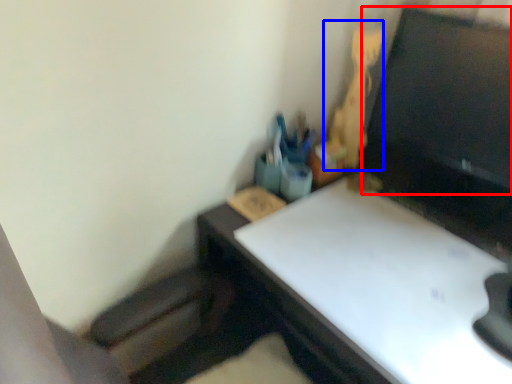
Question: Which of the following is the farthest to the observer, computer monitor (highlighted by a red box) or toy (highlighted by a blue box)?

Choices:
 (A) computer monitor
 (B) toy

Answer: (B)